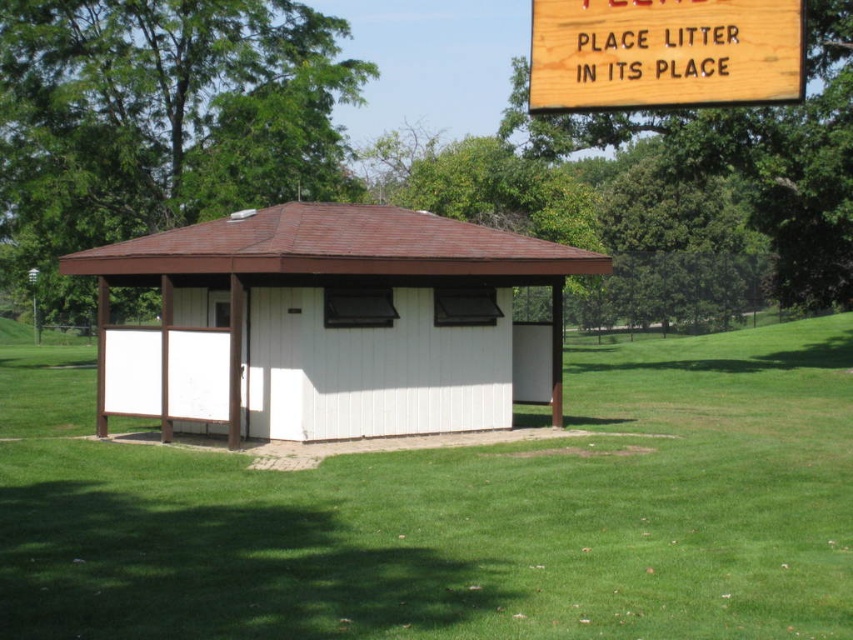
Question: Estimate the real-world distances between objects in this image. Which object is closer to the white wood hut at center?

Choices:
 (A) wooden sign at upper right
 (B) green grass at center

Answer: (B)

Question: Which is nearer to the wooden sign at upper right?

Choices:
 (A) green grass at center
 (B) white wood hut at center

Answer: (B)

Question: Does green grass at center appear on the left side of white wood hut at center?

Choices:
 (A) yes
 (B) no

Answer: (A)

Question: Can you confirm if green grass at center is positioned to the right of white wood hut at center?

Choices:
 (A) no
 (B) yes

Answer: (A)

Question: Which object appears farthest from the camera in this image?

Choices:
 (A) wooden sign at upper right
 (B) green grass at center

Answer: (A)

Question: Does green grass at center have a greater width compared to white wood hut at center?

Choices:
 (A) no
 (B) yes

Answer: (B)